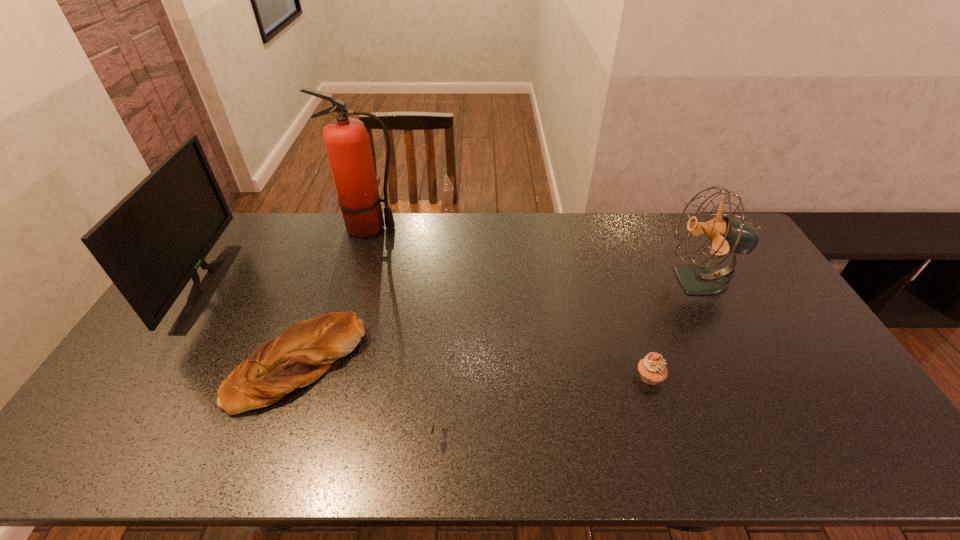
Where is `vacant point located between the rightmost object and the tallest object`? vacant point located between the rightmost object and the tallest object is located at coordinates (535, 254).

This screenshot has width=960, height=540. I want to click on free space between the third tallest object and the cupcake, so click(x=675, y=329).

Locate an element on the screen. This screenshot has width=960, height=540. free point between the bread and the fifth shortest object is located at coordinates [x=253, y=325].

Locate an element on the screen. The height and width of the screenshot is (540, 960). vacant space in between the tallest object and the fan is located at coordinates (535, 254).

The width and height of the screenshot is (960, 540). I want to click on free space between the fan and the fire extinguisher, so click(535, 254).

Find the location of a particular element. The width and height of the screenshot is (960, 540). the closest object to the fan is located at coordinates (652, 369).

Identify which object is the fifth closest to the sunglasses. Please provide its 2D coordinates. Your answer should be formatted as a tuple, i.e. [(x, y)], where the tuple contains the x and y coordinates of a point satisfying the conditions above.

[(727, 234)]

This screenshot has height=540, width=960. Find the location of `free space that satisfies the following two spatial constraints: 1. on the front-facing side of the fifth shortest object; 2. on the right side of the cupcake`. free space that satisfies the following two spatial constraints: 1. on the front-facing side of the fifth shortest object; 2. on the right side of the cupcake is located at coordinates (150, 376).

At what (x,y) coordinates should I click in order to perform the action: click on free location that satisfies the following two spatial constraints: 1. on the nozzle of the second object from right to left; 2. on the left side of the fire extinguisher. Please return your answer as a coordinate pair (x, y). Looking at the image, I should click on (324, 376).

Image resolution: width=960 pixels, height=540 pixels. Find the location of `free region that satisfies the following two spatial constraints: 1. on the back side of the second object from right to left; 2. on the front-facing side of the leftmost object`. free region that satisfies the following two spatial constraints: 1. on the back side of the second object from right to left; 2. on the front-facing side of the leftmost object is located at coordinates pyautogui.click(x=619, y=286).